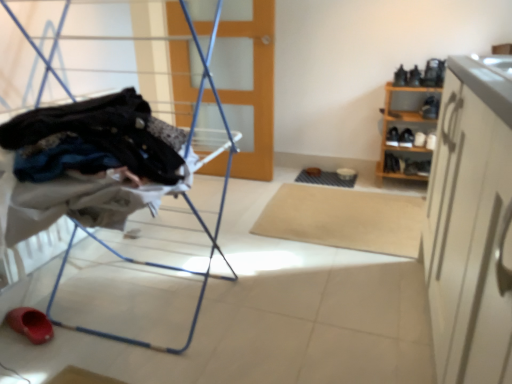
The image size is (512, 384). In order to click on vacant area that lies between rubber/soft sole shoe at lower left and metal laundry rack at left in this screenshot , I will do `click(61, 291)`.